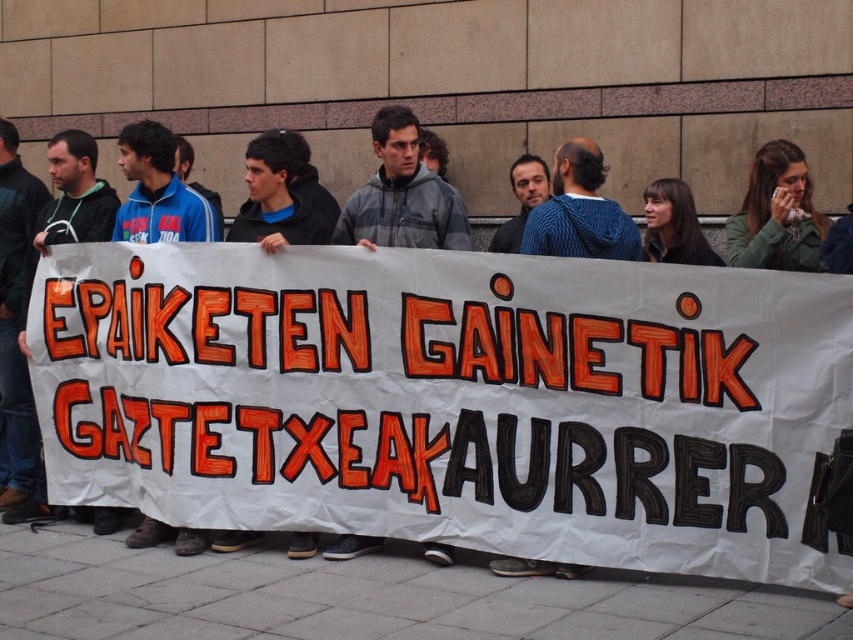
Question: Is white paper banner at center to the right of green fabric scarf at upper right from the viewer's perspective?

Choices:
 (A) no
 (B) yes

Answer: (A)

Question: Is white paper banner at center to the right of green fabric scarf at upper right from the viewer's perspective?

Choices:
 (A) no
 (B) yes

Answer: (A)

Question: Which point is farther to the camera?

Choices:
 (A) (805, 209)
 (B) (775, 291)

Answer: (A)

Question: Which object appears closest to the camera in this image?

Choices:
 (A) green fabric scarf at upper right
 (B) white paper banner at center

Answer: (B)

Question: Is white paper banner at center positioned in front of green fabric scarf at upper right?

Choices:
 (A) yes
 (B) no

Answer: (A)

Question: Which point is farther from the camera taking this photo?

Choices:
 (A) (593, 408)
 (B) (785, 252)

Answer: (B)